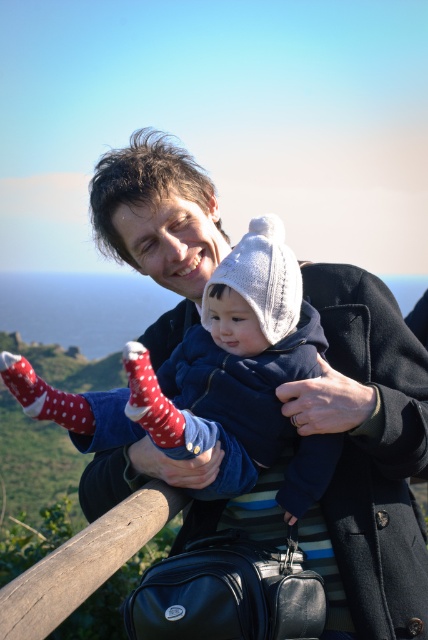
Question: Which of these objects is positioned closest to the red dotted socks at lower left?

Choices:
 (A) knitted woolen hat at center
 (B) red dotted socks at center

Answer: (B)

Question: Observing the image, what is the correct spatial positioning of knitted woolen hat at center in reference to red dotted socks at lower left?

Choices:
 (A) left
 (B) right

Answer: (B)

Question: Which point is farther from the camera taking this photo?

Choices:
 (A) (291, 472)
 (B) (152, 408)

Answer: (A)

Question: Is knitted woolen hat at center thinner than red dotted socks at center?

Choices:
 (A) no
 (B) yes

Answer: (B)

Question: Is knitted woolen hat at center wider than red dotted socks at center?

Choices:
 (A) yes
 (B) no

Answer: (B)

Question: Which point appears farthest from the camera in this image?

Choices:
 (A) (11, 394)
 (B) (162, 444)
 (C) (309, 438)

Answer: (A)